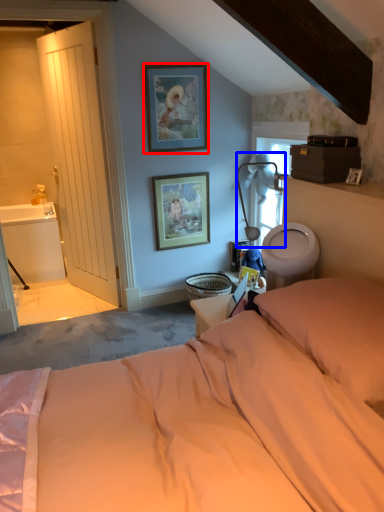
Question: Which of the following is the farthest to the observer, picture frame (highlighted by a red box) or table lamp (highlighted by a blue box)?

Choices:
 (A) picture frame
 (B) table lamp

Answer: (A)